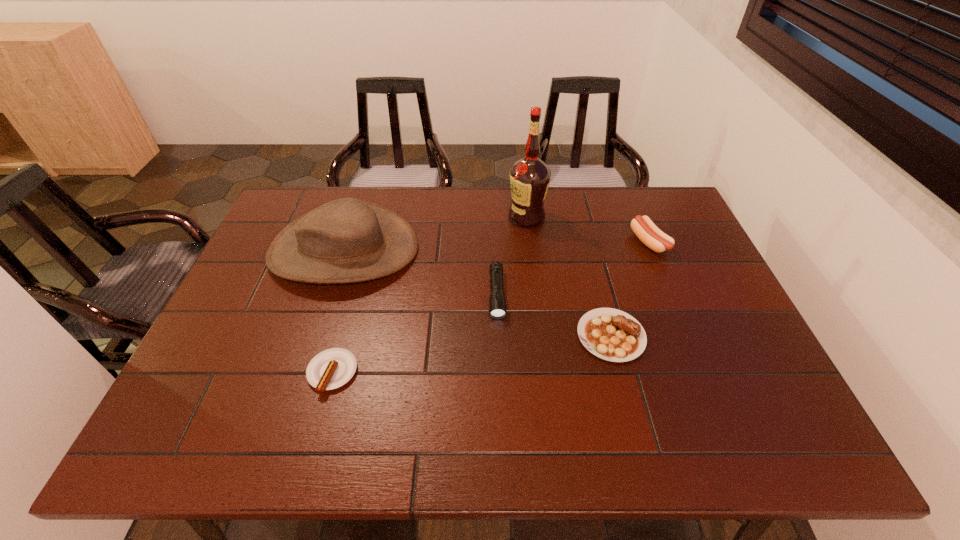
Locate an element on the screen. This screenshot has width=960, height=540. free space at the near right corner of the desktop is located at coordinates (754, 447).

At what (x,y) coordinates should I click in order to perform the action: click on empty location between the second object from right to left and the alcohol. Please return your answer as a coordinate pair (x, y). The image size is (960, 540). Looking at the image, I should click on click(568, 276).

Identify the location of vacant space that is in between the taller sausage and the tallest object. The width and height of the screenshot is (960, 540). (588, 230).

I want to click on free space between the second object from right to left and the cowboy hat, so click(477, 293).

Where is `vacant region between the third object from left to right and the steak`? The image size is (960, 540). vacant region between the third object from left to right and the steak is located at coordinates (554, 315).

The height and width of the screenshot is (540, 960). In order to click on vacant space in between the fourth tallest object and the alcohol in this screenshot , I will do `click(512, 256)`.

Where is `vacant point located between the third object from right to left and the fifth object from left to right`? The width and height of the screenshot is (960, 540). vacant point located between the third object from right to left and the fifth object from left to right is located at coordinates (568, 276).

Identify the location of empty location between the fourth object from left to right and the left sausage. The height and width of the screenshot is (540, 960). (429, 295).

Where is `empty space between the third object from right to left and the shorter sausage`? empty space between the third object from right to left and the shorter sausage is located at coordinates (429, 295).

Where is `free spot between the right sausage and the steak`? The width and height of the screenshot is (960, 540). free spot between the right sausage and the steak is located at coordinates (630, 289).